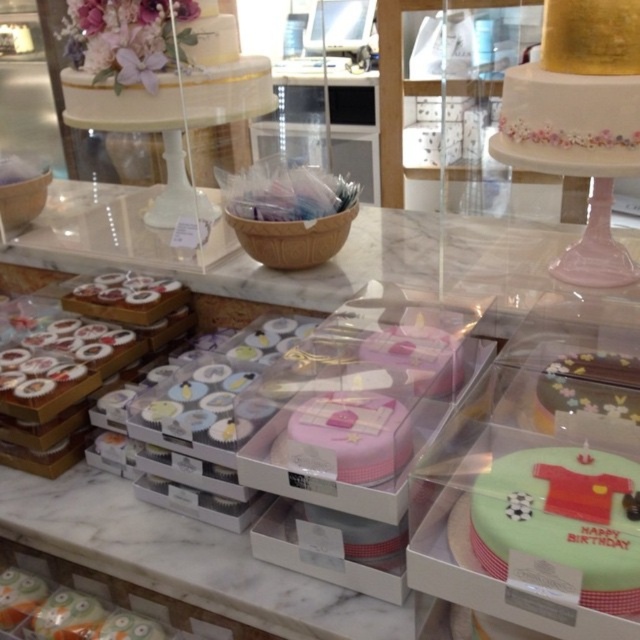
Question: Which point is farther to the camera?

Choices:
 (A) green matte cake at lower right
 (B) pink matte cupcake at center
 (C) pink matte cake at center

Answer: (C)

Question: Does gold metallic cake at upper right lie in front of white textured cake at upper left?

Choices:
 (A) no
 (B) yes

Answer: (B)

Question: Which object is closer to the camera taking this photo?

Choices:
 (A) gold metallic cake at upper right
 (B) white textured cake at upper left
 (C) pink matte cake at center
 (D) green frosted cake at lower right

Answer: (D)

Question: Does gold metallic cake at upper right lie behind green frosted cake at lower right?

Choices:
 (A) no
 (B) yes

Answer: (B)

Question: Which point is closer to the camera?

Choices:
 (A) green frosted cake at lower right
 (B) gold metallic cake at upper right
 (C) pink matte cake at center
 (D) green matte cake at lower right

Answer: (D)

Question: Where is white textured cake at upper left located in relation to pink matte cake at center in the image?

Choices:
 (A) below
 (B) above

Answer: (B)